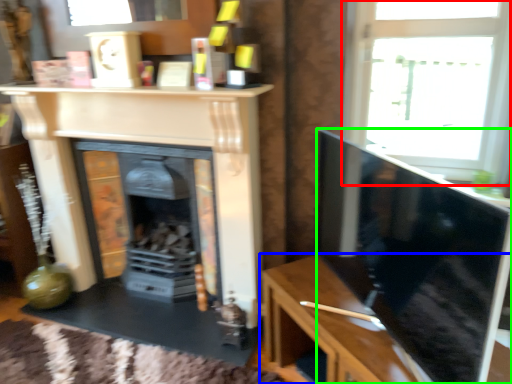
Question: Estimate the real-world distances between objects in this image. Which object is closer to window (highlighted by a red box), table (highlighted by a blue box) or screen (highlighted by a green box)?

Choices:
 (A) table
 (B) screen

Answer: (B)